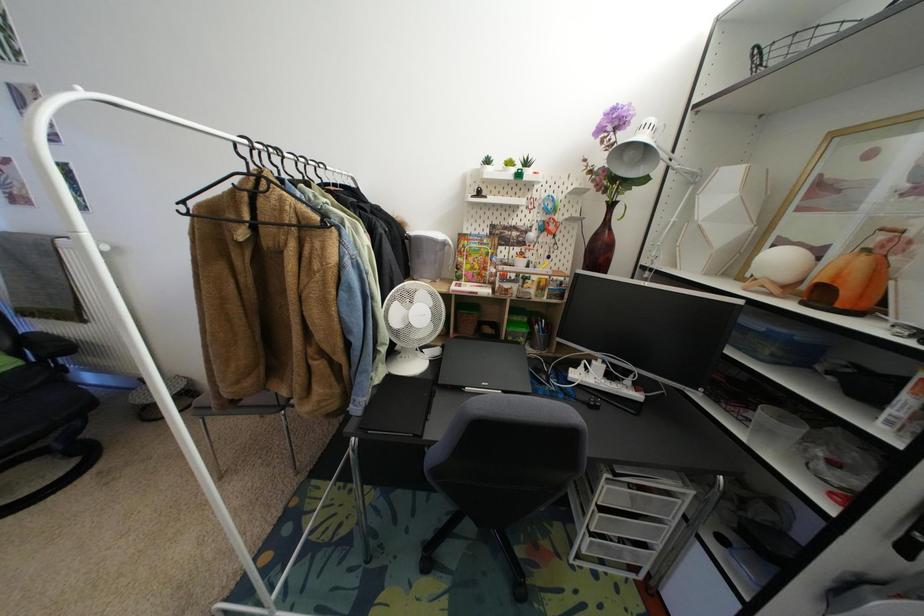
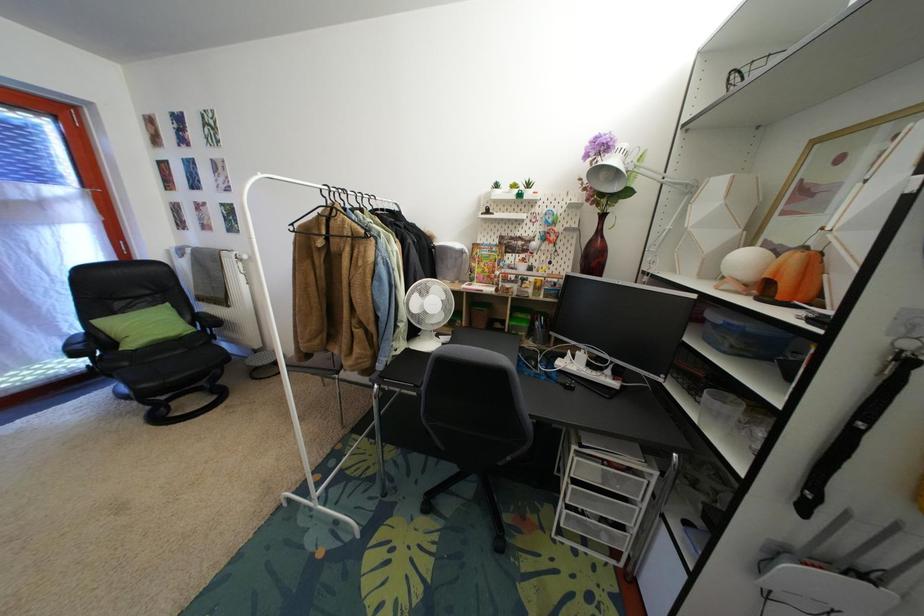
Which direction would the cameraman need to move to produce the second image?

The cameraman moved toward right, backward.